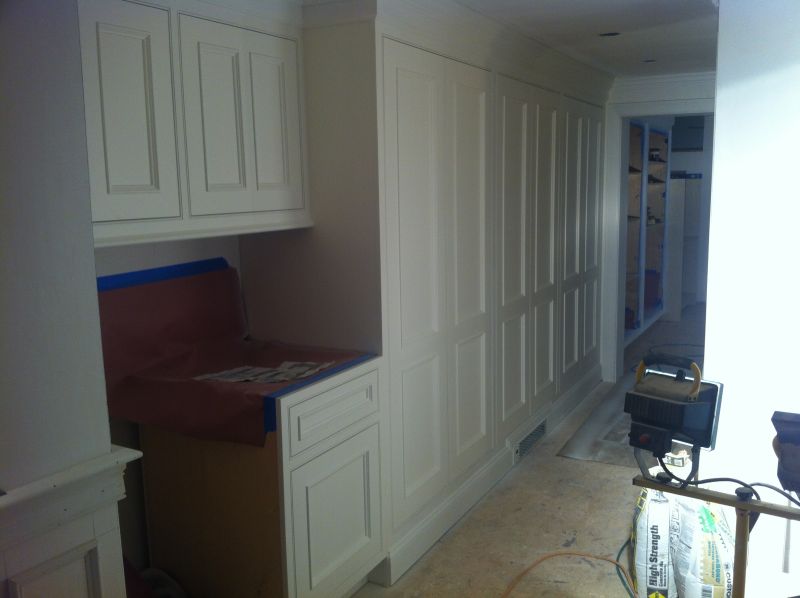
The image size is (800, 598). Identify the location of handle. (660, 360).